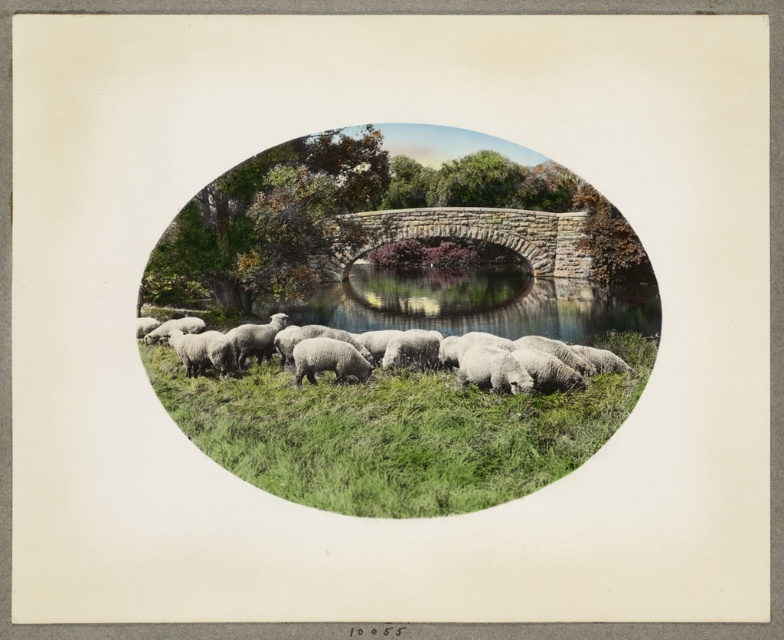
Is point (278, 209) positioned after point (234, 452)?

That is True.

Does white woolen sheep at center have a lesser height compared to green soft grass at lower center?

No.

I want to click on white woolen sheep at center, so click(394, 330).

Is point (452, 483) positioned after point (416, 209)?

No, it is in front of (416, 209).

Can you confirm if green soft grass at lower center is shorter than stone textured bridge at center?

In fact, green soft grass at lower center may be taller than stone textured bridge at center.

What do you see at coordinates (394, 432) in the screenshot?
I see `green soft grass at lower center` at bounding box center [394, 432].

What are the coordinates of `green soft grass at lower center` in the screenshot? It's located at (394, 432).

Which is behind, point (269, 332) or point (211, 340)?

Point (269, 332)

Between white woolly sheep at center and white woolly sheep at lower left, which one appears on the right side from the viewer's perspective?

white woolly sheep at center

In order to click on white woolly sheep at center in this screenshot , I will do `click(245, 340)`.

Where is `white woolly sheep at center`? The image size is (784, 640). white woolly sheep at center is located at coordinates (245, 340).